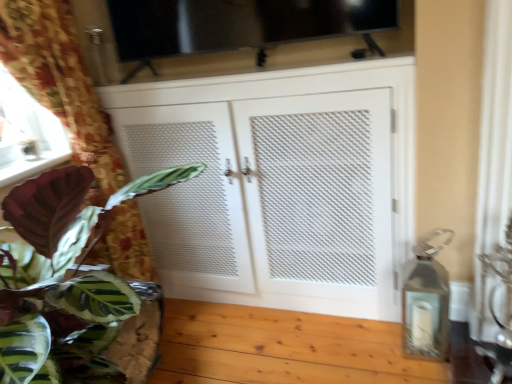
Question: Should I look upward or downward to see floral fabric curtain at left, arranged as the 1th curtain when viewed from the left?

Choices:
 (A) up
 (B) down

Answer: (B)

Question: Could transparent glass window screen at upper center be considered to be inside matte brown wood at lower left?

Choices:
 (A) yes
 (B) no

Answer: (B)

Question: From the image's perspective, does matte brown wood at lower left appear lower than transparent glass window screen at upper center?

Choices:
 (A) yes
 (B) no

Answer: (A)

Question: Considering the relative sizes of matte brown wood at lower left and transparent glass window screen at upper center in the image provided, is matte brown wood at lower left bigger than transparent glass window screen at upper center?

Choices:
 (A) yes
 (B) no

Answer: (B)

Question: Considering the relative positions of matte brown wood at lower left and transparent glass window screen at upper center in the image provided, is matte brown wood at lower left in front of transparent glass window screen at upper center?

Choices:
 (A) yes
 (B) no

Answer: (B)

Question: Would you say matte brown wood at lower left is outside transparent glass window screen at upper center?

Choices:
 (A) no
 (B) yes

Answer: (B)

Question: Could you tell me if matte brown wood at lower left is facing transparent glass window screen at upper center?

Choices:
 (A) no
 (B) yes

Answer: (A)

Question: From a real-world perspective, is green leafy plant at left positioned over matte brown wood at lower left based on gravity?

Choices:
 (A) no
 (B) yes

Answer: (A)

Question: Considering the relative positions of green leafy plant at left and matte brown wood at lower left in the image provided, is green leafy plant at left to the left of matte brown wood at lower left from the viewer's perspective?

Choices:
 (A) yes
 (B) no

Answer: (B)

Question: Is the depth of green leafy plant at left greater than that of matte brown wood at lower left?

Choices:
 (A) no
 (B) yes

Answer: (A)

Question: Does green leafy plant at left touch matte brown wood at lower left?

Choices:
 (A) no
 (B) yes

Answer: (A)

Question: Could you tell me if green leafy plant at left is facing matte brown wood at lower left?

Choices:
 (A) no
 (B) yes

Answer: (A)

Question: Does green leafy plant at left have a larger size compared to matte brown wood at lower left?

Choices:
 (A) yes
 (B) no

Answer: (A)

Question: Is green leafy plant at left bigger than floral fabric curtain at left, marked as the 2th curtain in a right-to-left arrangement?

Choices:
 (A) yes
 (B) no

Answer: (A)